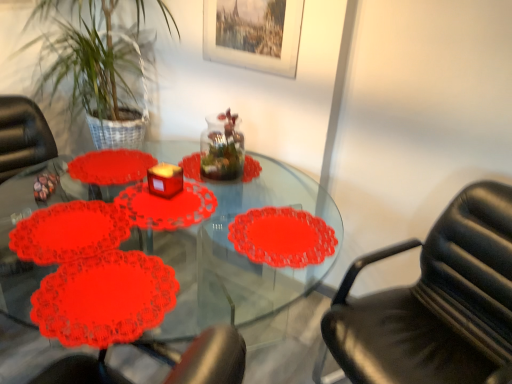
Question: From the image's perspective, is transparent glass jar at center positioned above or below lacy paper doily at lower left?

Choices:
 (A) above
 (B) below

Answer: (A)

Question: In the image, is transparent glass jar at center on the left side or the right side of lacy paper doily at lower left?

Choices:
 (A) right
 (B) left

Answer: (A)

Question: Estimate the real-world distances between objects in this image. Which object is closer to the lacy paper doily at lower left?

Choices:
 (A) wooden picture frame at upper center
 (B) transparent glass jar at center
 (C) green leafy plant at upper left
 (D) matte red candle at center
 (E) black leather chair at right

Answer: (D)

Question: Estimate the real-world distances between objects in this image. Which object is farther from the matte red candle at center?

Choices:
 (A) wooden picture frame at upper center
 (B) green leafy plant at upper left
 (C) black leather chair at right
 (D) lacy paper doily at lower left
 (E) transparent glass jar at center

Answer: (C)